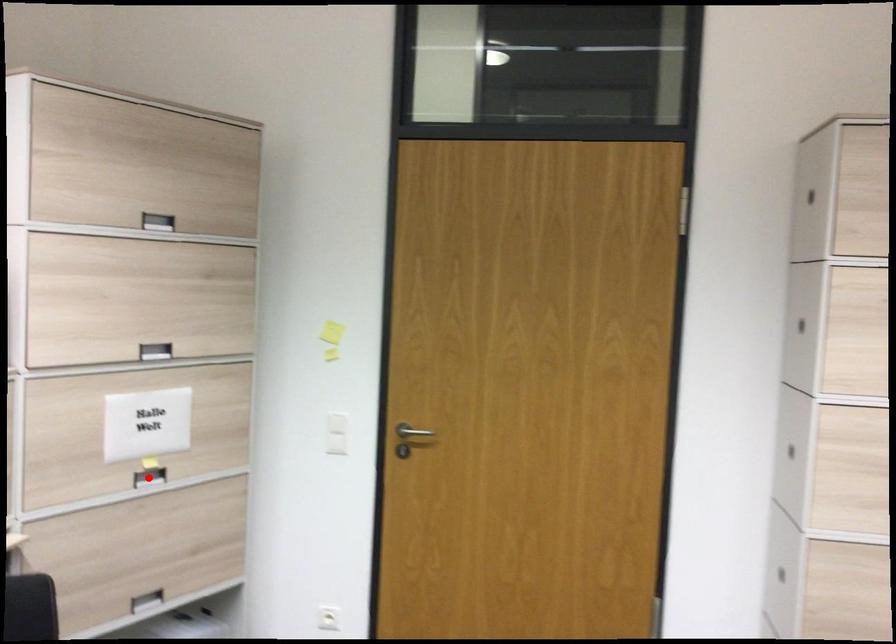
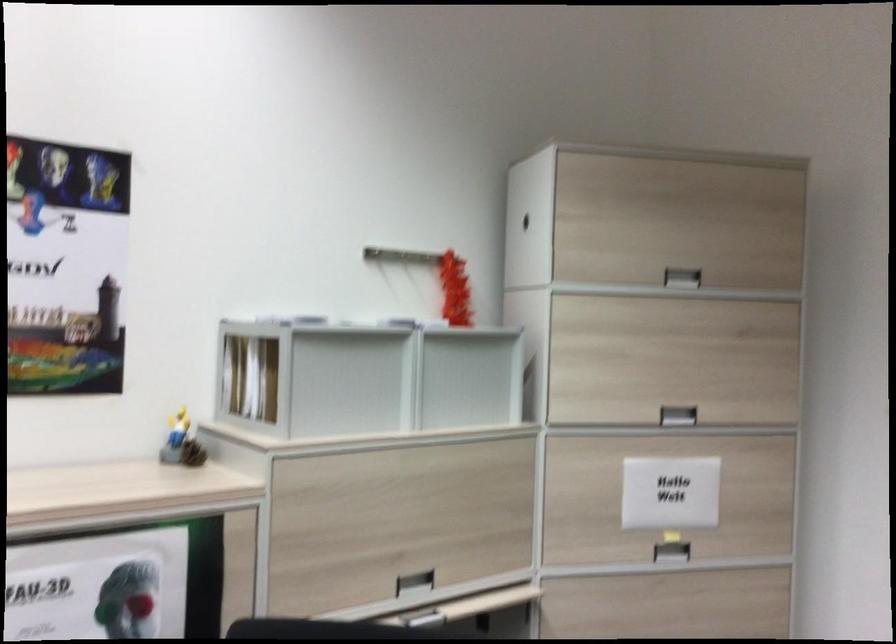
Locate, in the second image, the point that corresponds to the highlighted location in the first image.

(670, 552)